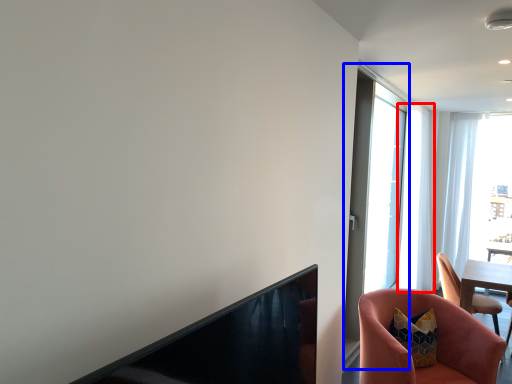
Question: Among these objects, which one is nearest to the camera, curtain (highlighted by a red box) or screen door (highlighted by a blue box)?

Choices:
 (A) curtain
 (B) screen door

Answer: (B)